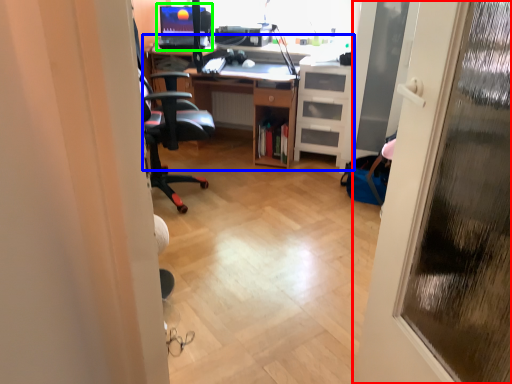
Question: Considering the real-world distances, which object is farthest from door (highlighted by a red box)? computer desk (highlighted by a blue box) or desktop computer (highlighted by a green box)?

Choices:
 (A) computer desk
 (B) desktop computer

Answer: (B)